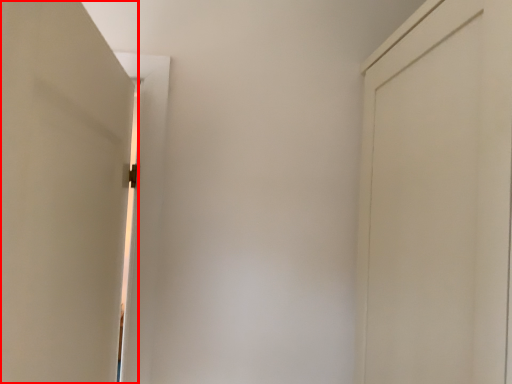
Question: In this image, where is door (annotated by the red box) located relative to door?

Choices:
 (A) left
 (B) right

Answer: (A)